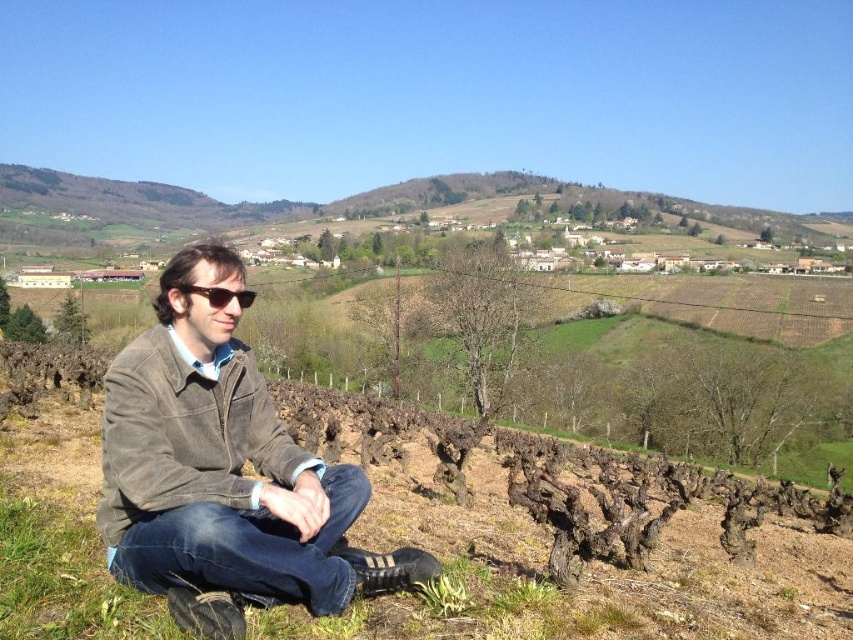
Question: Can you confirm if brown suede jacket at center is smaller than matte black sunglasses at center?

Choices:
 (A) no
 (B) yes

Answer: (A)

Question: Is brown corduroy jacket at lower left above matte black sunglasses at center?

Choices:
 (A) no
 (B) yes

Answer: (A)

Question: Considering the real-world distances, which object is farthest from the brown suede jacket at center?

Choices:
 (A) matte black sunglasses at center
 (B) brown corduroy jacket at lower left

Answer: (A)

Question: Is brown suede jacket at center to the left of matte black sunglasses at center from the viewer's perspective?

Choices:
 (A) no
 (B) yes

Answer: (B)

Question: Estimate the real-world distances between objects in this image. Which object is farther from the brown corduroy jacket at lower left?

Choices:
 (A) matte black sunglasses at center
 (B) brown suede jacket at center

Answer: (A)

Question: Which point is farther to the camera?

Choices:
 (A) brown suede jacket at center
 (B) matte black sunglasses at center
 (C) brown corduroy jacket at lower left

Answer: (B)